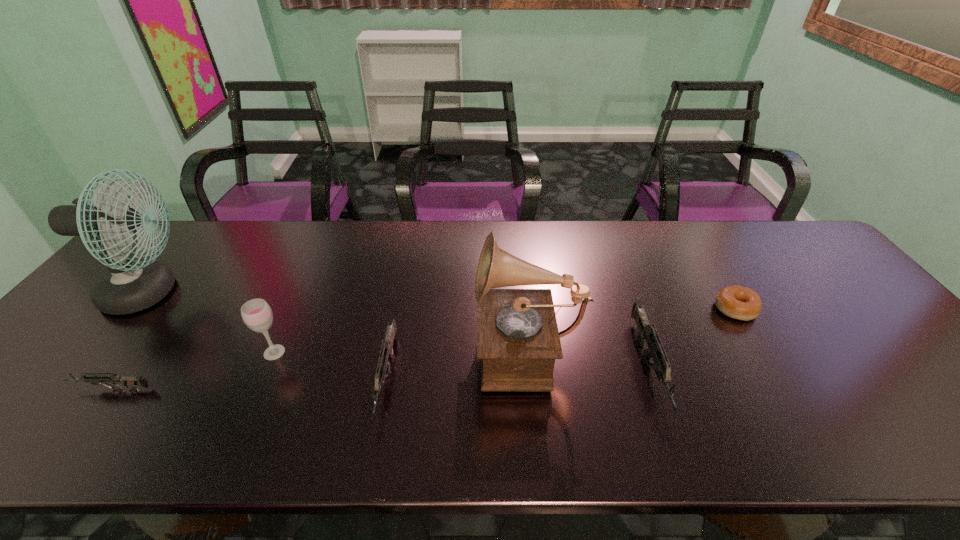
Identify the location of object that is at the far left corner. This screenshot has width=960, height=540. (129, 286).

Locate an element on the screen. The height and width of the screenshot is (540, 960). object located in the near left corner section of the desktop is located at coordinates (129, 382).

Find the location of a particular element. The image size is (960, 540). vacant space at the far edge of the desktop is located at coordinates (280, 226).

In the image, there is a desktop. At what (x,y) coordinates should I click in order to perform the action: click on vacant space at the right edge. Please return your answer as a coordinate pair (x, y). The height and width of the screenshot is (540, 960). Looking at the image, I should click on (892, 366).

In the image, there is a desktop. In order to click on free space at the far left corner in this screenshot , I will do `click(187, 237)`.

The height and width of the screenshot is (540, 960). What are the coordinates of `blank space at the near left corner of the desktop` in the screenshot? It's located at (16, 410).

The width and height of the screenshot is (960, 540). I want to click on vacant area at the far right corner of the desktop, so click(x=796, y=235).

Find the location of `vacant space in between the fan and the bagel`. vacant space in between the fan and the bagel is located at coordinates (442, 301).

This screenshot has height=540, width=960. What are the coordinates of `free space between the shortest gun and the fourth object from left to right` in the screenshot? It's located at (250, 383).

Where is `vacant area that lies between the fourth object from right to left and the third tallest object`? The height and width of the screenshot is (540, 960). vacant area that lies between the fourth object from right to left and the third tallest object is located at coordinates (330, 366).